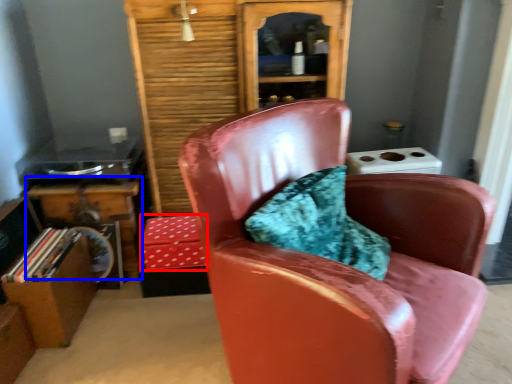
Question: Which object is closer to the camera taking this photo, box (highlighted by a red box) or table (highlighted by a blue box)?

Choices:
 (A) box
 (B) table

Answer: (A)